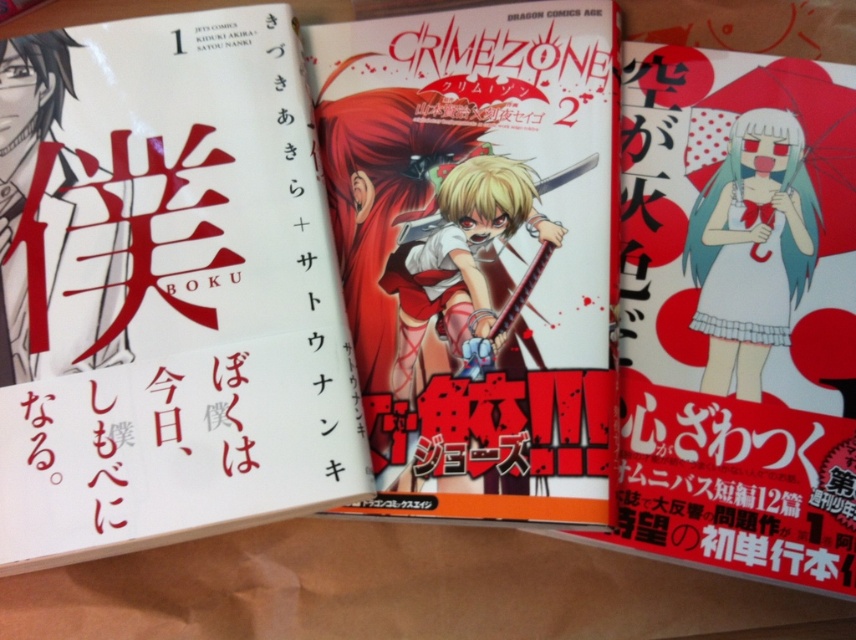
Question: Which object appears farthest from the camera in this image?

Choices:
 (A) white matte book at center
 (B) matte white manga at center

Answer: (B)

Question: Observing the image, what is the correct spatial positioning of white matte book at center in reference to matte white manga at center?

Choices:
 (A) above
 (B) below

Answer: (B)

Question: Does white matte book at center have a larger size compared to matte white manga at center?

Choices:
 (A) yes
 (B) no

Answer: (A)

Question: Which point is closer to the camera?

Choices:
 (A) (354, 296)
 (B) (197, 332)

Answer: (B)

Question: Which point is closer to the camera taking this photo?

Choices:
 (A) (177, 81)
 (B) (432, 152)

Answer: (A)

Question: Does white matte book at center appear over matte white manga at center?

Choices:
 (A) no
 (B) yes

Answer: (A)